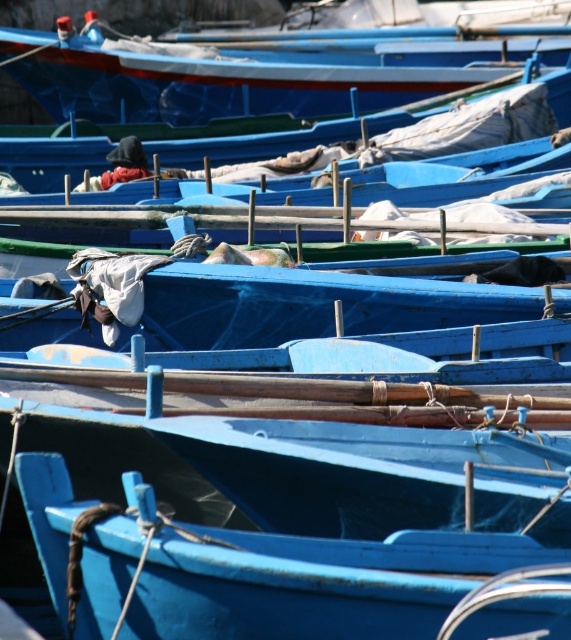
Is smooth blue boat at center taller than blue matte boat at center?

Yes, smooth blue boat at center is taller than blue matte boat at center.

Which is in front, point (122, 580) or point (243, 337)?

Positioned in front is point (122, 580).

Does point (496, 600) lie in front of point (297, 305)?

Yes, it is in front of point (297, 305).

Where is `smooth blue boat at center`? smooth blue boat at center is located at coordinates pyautogui.click(x=282, y=576).

Is point (250, 285) farther from camera compared to point (363, 108)?

No.

The width and height of the screenshot is (571, 640). Describe the element at coordinates (311, 305) in the screenshot. I see `blue matte boat at center` at that location.

Locate an element on the screen. blue matte boat at center is located at coordinates (311, 305).

Can you confirm if smooth blue boat at center is positioned to the left of blue painted wood boat at upper center?

Incorrect, smooth blue boat at center is not on the left side of blue painted wood boat at upper center.

Which is more to the right, smooth blue boat at center or blue painted wood boat at upper center?

smooth blue boat at center

Identify the location of smooth blue boat at center. (282, 576).